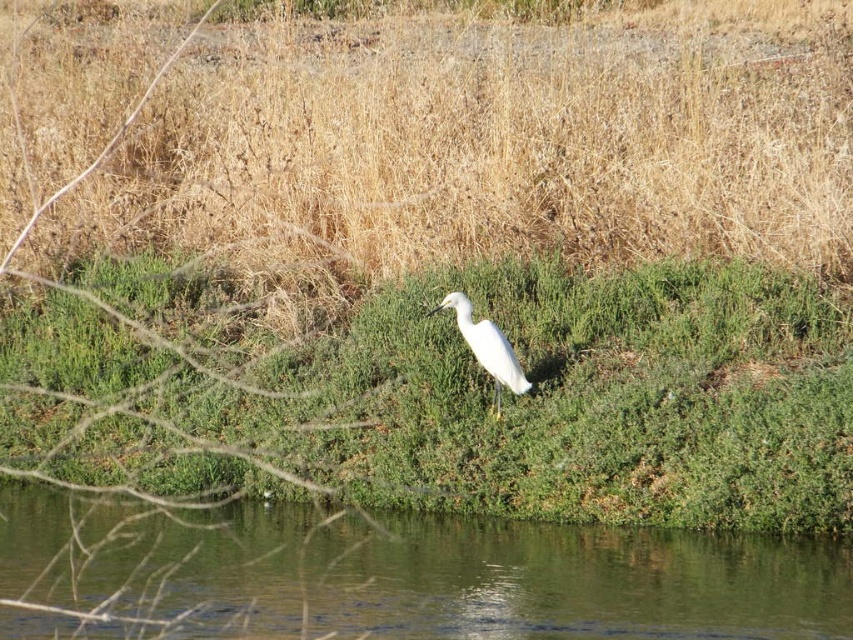
You are a photographer trying to capture the white smooth bird at center. You want to ensure the bird is clearly visible against the green grassy riverbank at center. Based on their heights, would the bird stand out in terms of size relative to the riverbank?

The green grassy riverbank at center is shorter than the white smooth bird at center, so the bird would stand out in terms of size as it is taller than the riverbank.

You are a photographer aiming to capture a closeup of the white smooth bird at center without including the green grassy riverbank at center in the frame. Based on their sizes, is this possible?

The green grassy riverbank at center is wider than the white smooth bird at center, so it may be challenging to frame the bird without including some of the riverbank in the shot.

Based on the scene description, where is the green grassy riverbank at center located in the image?

The green grassy riverbank at center is located at point 0.905 on the x axis and 0.559 on the y axis.